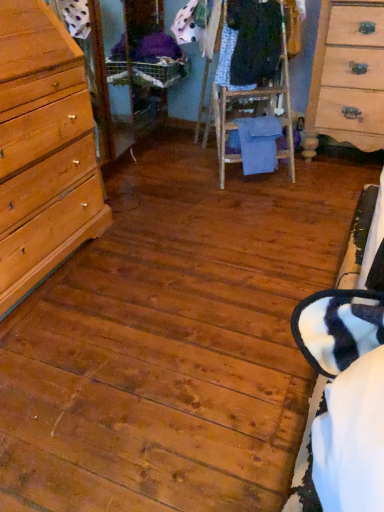
Question: From a real-world perspective, is patterned fabric dress at center, marked as the 2th clothing in a top-to-bottom arrangement, over light wood/finish dresser at right?

Choices:
 (A) yes
 (B) no

Answer: (A)

Question: Does patterned fabric dress at center, the 2th clothing in the bottom-to-top sequence, have a greater height compared to light wood/finish dresser at right?

Choices:
 (A) yes
 (B) no

Answer: (B)

Question: From a real-world perspective, is patterned fabric dress at center, the 2th clothing in the bottom-to-top sequence, under light wood/finish dresser at right?

Choices:
 (A) no
 (B) yes

Answer: (A)

Question: Can you confirm if patterned fabric dress at center, the 2th clothing in the bottom-to-top sequence, is bigger than light wood/finish dresser at right?

Choices:
 (A) yes
 (B) no

Answer: (B)

Question: From the image's perspective, is patterned fabric dress at center, the 2th clothing in the bottom-to-top sequence, located beneath light wood/finish dresser at right?

Choices:
 (A) no
 (B) yes

Answer: (A)

Question: From the image's perspective, relative to blue cotton towel at center, the 1th clothing from the bottom, is light wood/finish dresser at right above or below?

Choices:
 (A) below
 (B) above

Answer: (B)

Question: From a real-world perspective, relative to blue cotton towel at center, marked as the third clothing in a top-to-bottom arrangement, is light wood/finish dresser at right vertically above or below?

Choices:
 (A) below
 (B) above

Answer: (B)

Question: Which is correct: light wood/finish dresser at right is inside blue cotton towel at center, marked as the third clothing in a top-to-bottom arrangement, or outside of it?

Choices:
 (A) outside
 (B) inside

Answer: (A)

Question: Is light wood/finish dresser at right taller or shorter than blue cotton towel at center, the 1th clothing from the bottom?

Choices:
 (A) tall
 (B) short

Answer: (A)

Question: From the image's perspective, is dark blue fabric at center, which is counted as the 3th clothing, starting from the bottom, positioned above or below patterned fabric dress at center, the 2th clothing in the bottom-to-top sequence?

Choices:
 (A) above
 (B) below

Answer: (A)

Question: Looking at their shapes, would you say dark blue fabric at center, the 1th clothing in the top-to-bottom sequence, is wider or thinner than patterned fabric dress at center, the 2th clothing in the bottom-to-top sequence?

Choices:
 (A) thin
 (B) wide

Answer: (B)

Question: Would you say dark blue fabric at center, the 1th clothing in the top-to-bottom sequence, is inside or outside patterned fabric dress at center, the 2th clothing in the bottom-to-top sequence?

Choices:
 (A) inside
 (B) outside

Answer: (B)

Question: From a real-world perspective, relative to patterned fabric dress at center, the 2th clothing in the bottom-to-top sequence, is dark blue fabric at center, the 1th clothing in the top-to-bottom sequence, vertically above or below?

Choices:
 (A) below
 (B) above

Answer: (B)

Question: From their relative heights in the image, would you say patterned fabric dress at center, marked as the 2th clothing in a top-to-bottom arrangement, is taller or shorter than light wood/finish dresser at right?

Choices:
 (A) tall
 (B) short

Answer: (B)

Question: Looking at their shapes, would you say patterned fabric dress at center, the 2th clothing in the bottom-to-top sequence, is wider or thinner than light wood/finish dresser at right?

Choices:
 (A) thin
 (B) wide

Answer: (A)